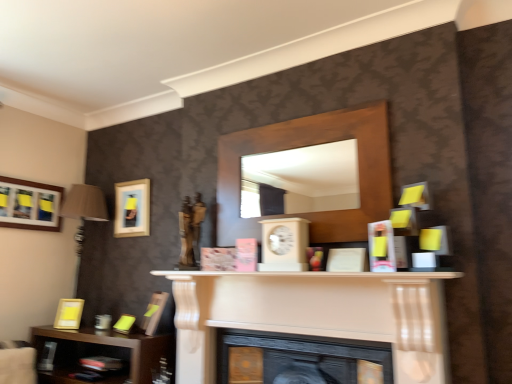
Where is `free space above wooden clock at center (from a real-world perspective)`? The image size is (512, 384). free space above wooden clock at center (from a real-world perspective) is located at coordinates (284, 217).